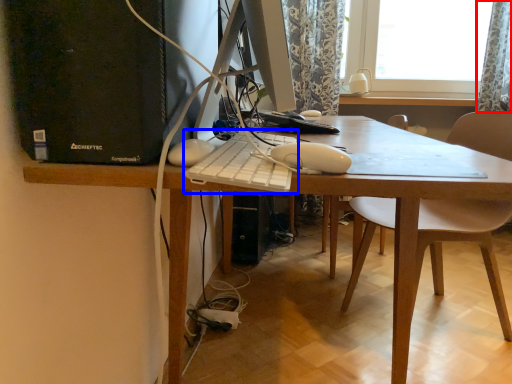
Question: Among these objects, which one is farthest to the camera, curtain (highlighted by a red box) or computer keyboard (highlighted by a blue box)?

Choices:
 (A) curtain
 (B) computer keyboard

Answer: (A)